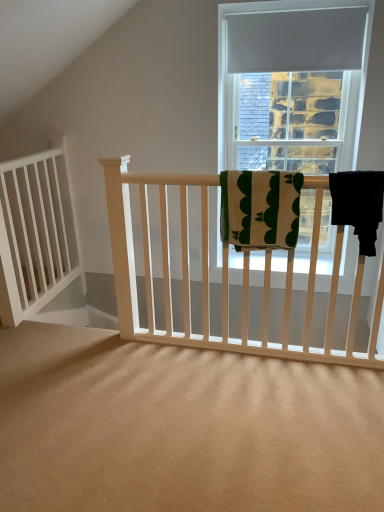
Question: Is green cotton towel at center, the first beach towel positioned from the left, to the left or to the right of white wood balustrade at left in the image?

Choices:
 (A) left
 (B) right

Answer: (B)

Question: Is green cotton towel at center, the 2th beach towel positioned from the right, taller or shorter than white wood balustrade at left?

Choices:
 (A) short
 (B) tall

Answer: (A)

Question: Which of these objects is positioned closest to the black fabric towel at right, placed as the 1th beach towel when sorted from right to left?

Choices:
 (A) white wood balustrade at left
 (B) matte gray curtain at upper center
 (C) green cotton towel at center, the first beach towel positioned from the left

Answer: (C)

Question: Which object is the farthest from the matte gray curtain at upper center?

Choices:
 (A) black fabric towel at right, which is the second beach towel in left-to-right order
 (B) white wood balustrade at left
 (C) green cotton towel at center, the 2th beach towel positioned from the right

Answer: (B)